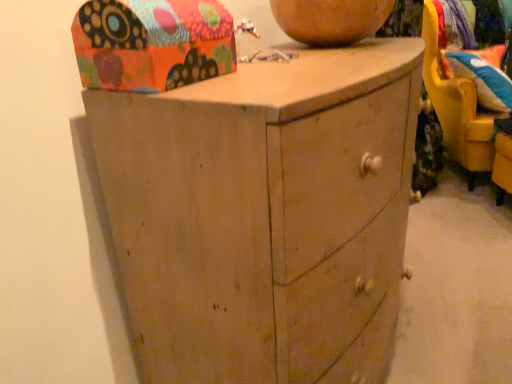
Question: From a real-world perspective, is floral fabric cushion at upper right physically above matte wood chest of drawers at center?

Choices:
 (A) yes
 (B) no

Answer: (A)

Question: Considering the relative sizes of floral fabric cushion at upper right and matte wood chest of drawers at center in the image provided, is floral fabric cushion at upper right bigger than matte wood chest of drawers at center?

Choices:
 (A) no
 (B) yes

Answer: (A)

Question: Is floral fabric cushion at upper right positioned with its back to matte wood chest of drawers at center?

Choices:
 (A) no
 (B) yes

Answer: (A)

Question: Can you confirm if floral fabric cushion at upper right is positioned to the right of matte wood chest of drawers at center?

Choices:
 (A) no
 (B) yes

Answer: (B)

Question: Is floral fabric cushion at upper right outside of matte wood chest of drawers at center?

Choices:
 (A) no
 (B) yes

Answer: (B)

Question: Considering the positions of point (339, 39) and point (482, 84), is point (339, 39) closer or farther from the camera than point (482, 84)?

Choices:
 (A) closer
 (B) farther

Answer: (A)

Question: Is matte brown vase at upper center taller or shorter than velvet blue pillow at right?

Choices:
 (A) tall
 (B) short

Answer: (B)

Question: Visually, is matte brown vase at upper center positioned to the left or to the right of velvet blue pillow at right?

Choices:
 (A) right
 (B) left

Answer: (B)

Question: Looking at the image, does matte brown vase at upper center seem bigger or smaller compared to velvet blue pillow at right?

Choices:
 (A) big
 (B) small

Answer: (B)

Question: Considering the positions of yellow plastic swivel chair at right and matte brown vase at upper center in the image, is yellow plastic swivel chair at right taller or shorter than matte brown vase at upper center?

Choices:
 (A) tall
 (B) short

Answer: (A)

Question: Visually, is yellow plastic swivel chair at right positioned to the left or to the right of matte brown vase at upper center?

Choices:
 (A) right
 (B) left

Answer: (A)

Question: Considering the positions of yellow plastic swivel chair at right and matte brown vase at upper center in the image, is yellow plastic swivel chair at right bigger or smaller than matte brown vase at upper center?

Choices:
 (A) small
 (B) big

Answer: (B)

Question: Is point (457, 96) positioned closer to the camera than point (293, 34)?

Choices:
 (A) farther
 (B) closer

Answer: (A)

Question: Do you think matte brown vase at upper center is within matte wood chest of drawers at center, or outside of it?

Choices:
 (A) inside
 (B) outside

Answer: (B)

Question: From the image's perspective, is matte brown vase at upper center above or below matte wood chest of drawers at center?

Choices:
 (A) below
 (B) above

Answer: (B)